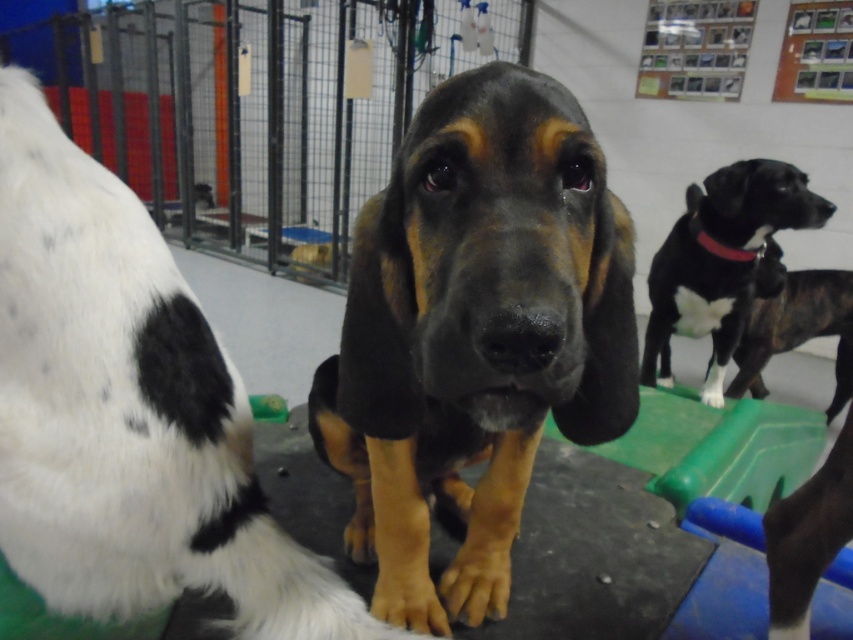
Does black smooth fur at center have a lesser width compared to brindle fur dog at right?

Indeed, black smooth fur at center has a lesser width compared to brindle fur dog at right.

Which is above, black smooth fur at center or brindle fur dog at right?

brindle fur dog at right is higher up.

Which is in front, point (245, 586) or point (849, 296)?

Point (245, 586) is more forward.

Identify the location of black smooth fur at center. (126, 412).

Looking at this image, is black smooth dog at center shorter than black smooth dog at upper right?

Indeed, black smooth dog at center has a lesser height compared to black smooth dog at upper right.

Which is in front, point (523, 72) or point (695, 262)?

Point (523, 72)

The width and height of the screenshot is (853, 640). In order to click on black smooth dog at center in this screenshot , I will do click(x=474, y=333).

Is black smooth dog at center thinner than black smooth fur at center?

Yes.

Describe the element at coordinates (474, 333) in the screenshot. The image size is (853, 640). I see `black smooth dog at center` at that location.

The width and height of the screenshot is (853, 640). What are the coordinates of `black smooth dog at center` in the screenshot? It's located at (474, 333).